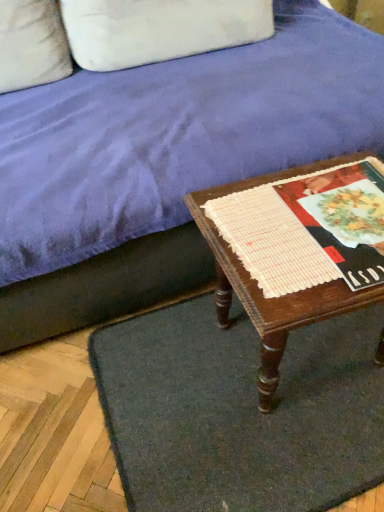
What are the coordinates of `vacant area on top of white woven placemat at center (from a real-world perspective)` in the screenshot? It's located at (318, 210).